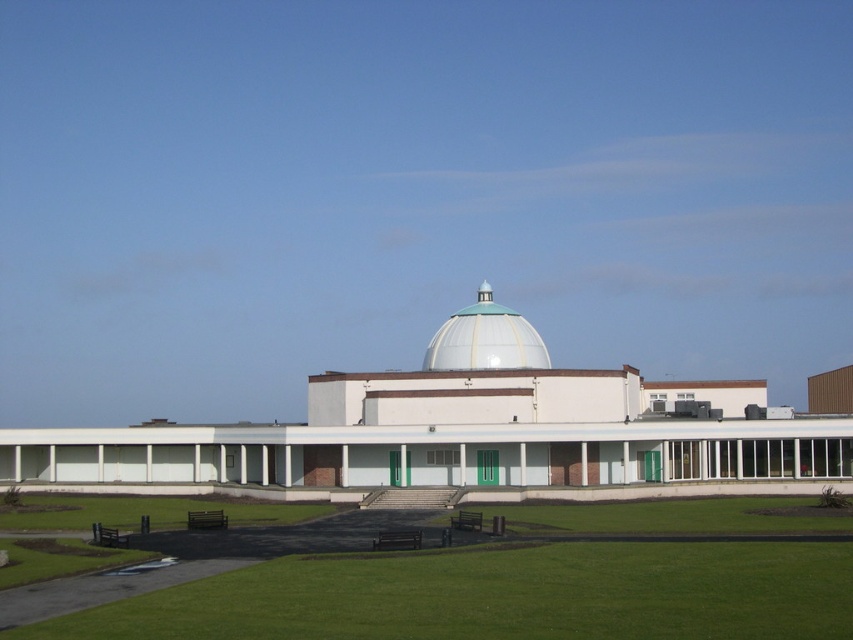
Who is lower down, green grass at lower center or white glossy dome at center?

green grass at lower center

Is point (581, 579) farther from camera compared to point (482, 298)?

No, (581, 579) is in front of (482, 298).

Does point (434, 596) come behind point (524, 333)?

That is False.

Where is `green grass at lower center`? This screenshot has width=853, height=640. green grass at lower center is located at coordinates (498, 595).